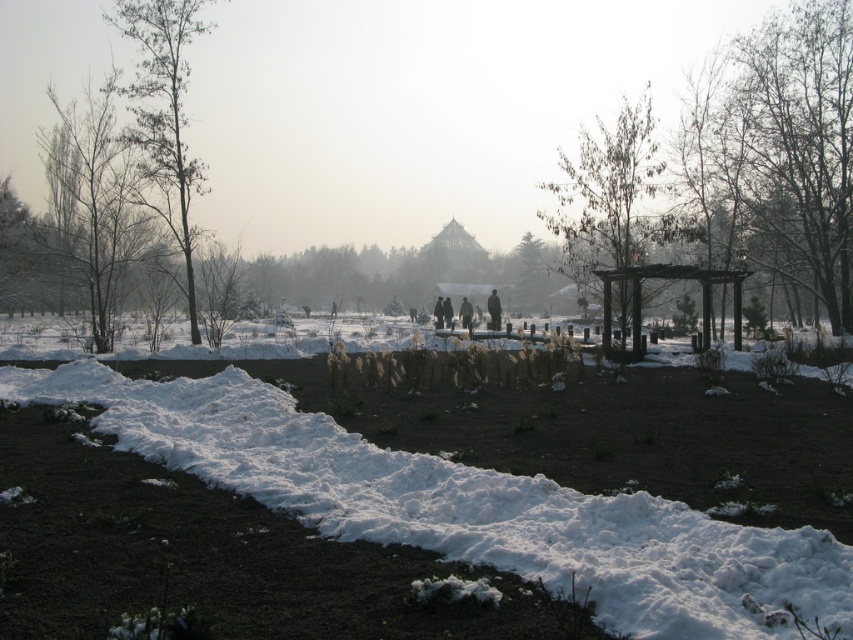
You are standing at the point labeled point (612, 276) and want to walk to the point labeled point (486, 301). Given that the path between them is over a snow mound, will you be walking uphill or downhill?

Since point (612, 276) is closer to the camera than point (486, 301), this indicates that you are currently at a higher elevation. Therefore, walking towards point (486, 301) would mean going downhill.

You are planning to build a small wooden bench in the winter scene shown. The bench needs to be placed between the brown wooden gazebo at center and the black matte person at center. Given that the gazebo is wider than the person, where should you position the bench so that it is closer to the narrower object?

The bench should be placed closer to the black matte person at center since it is narrower than the brown wooden gazebo at center.